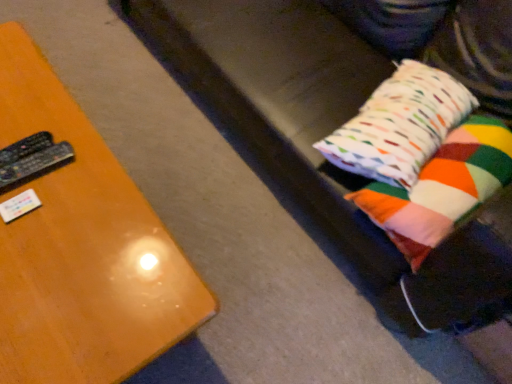
Identify the location of vacant area that is in front of black plastic remote at left, placed as the second remote when sorted from top to bottom. (31, 239).